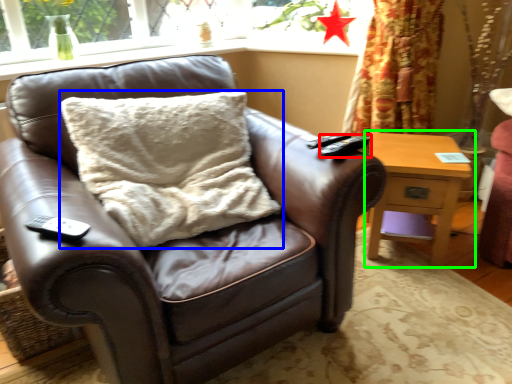
Question: Which is nearer to the remote (highlighted by a red box)? pillow (highlighted by a blue box) or nightstand (highlighted by a green box).

Choices:
 (A) pillow
 (B) nightstand

Answer: (A)